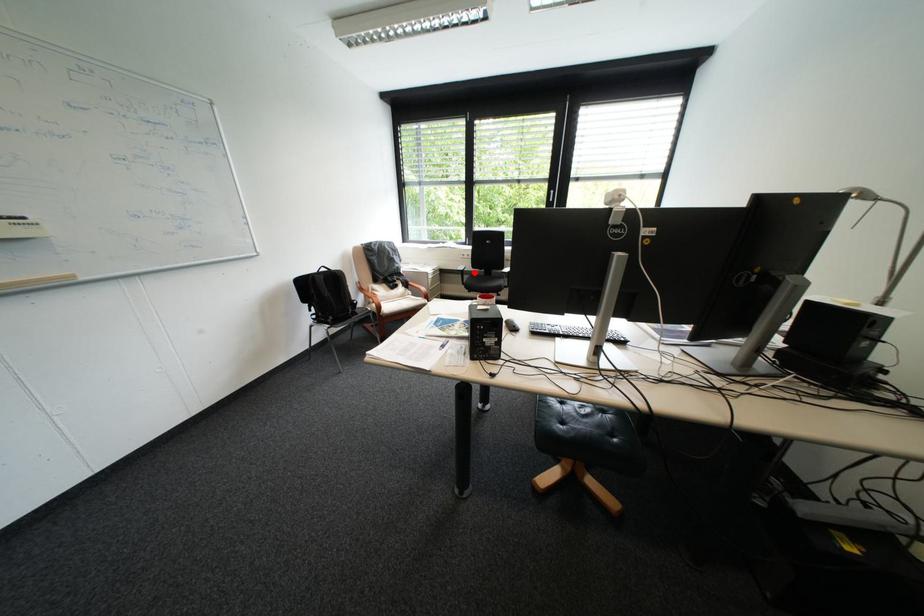
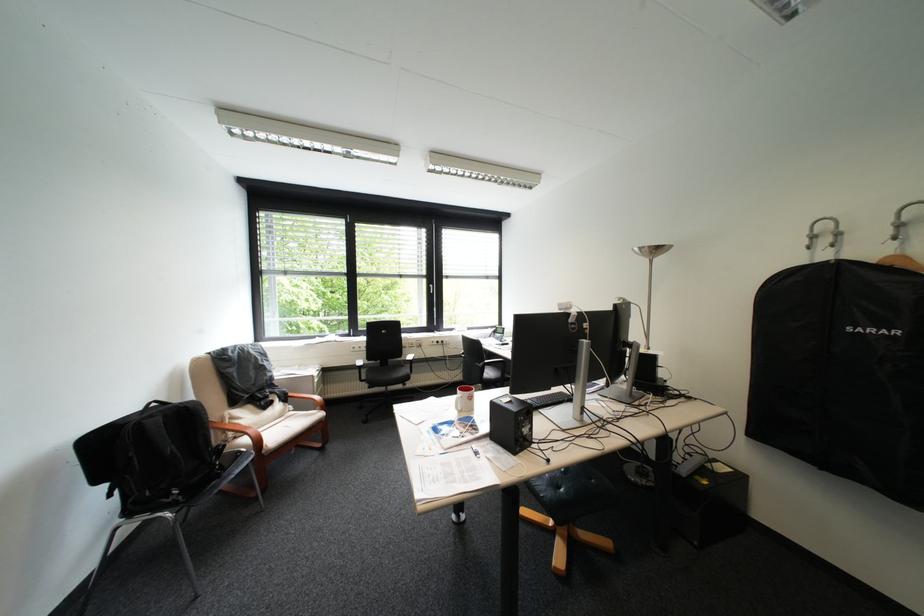
In the second image, find the point that corresponds to the highlighted location in the first image.

(371, 368)